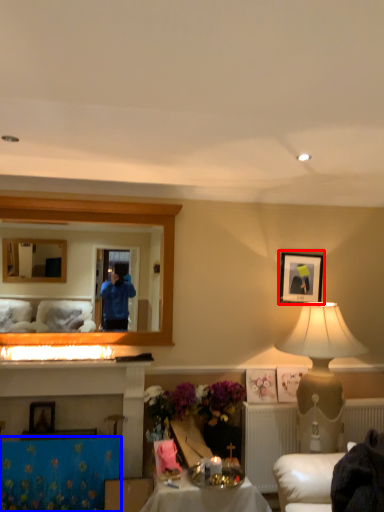
Question: Which object is further to the camera taking this photo, picture frame (highlighted by a red box) or tablecloth (highlighted by a blue box)?

Choices:
 (A) picture frame
 (B) tablecloth

Answer: (A)